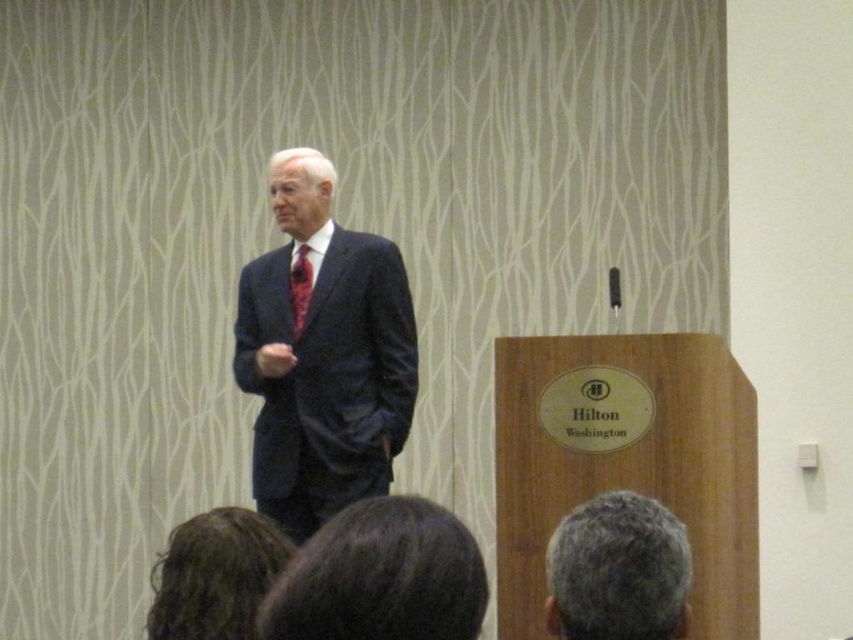
Question: Based on their relative distances, which object is nearer to the dark brown hair at lower left?

Choices:
 (A) dark brown hair at lower center
 (B) shiny red tie at center

Answer: (A)

Question: Is dark blue suit at center smaller than gray hair at lower center?

Choices:
 (A) no
 (B) yes

Answer: (A)

Question: In this image, where is dark blue suit at center located relative to shiny red tie at center?

Choices:
 (A) above
 (B) below

Answer: (B)

Question: Which is farther from the shiny red tie at center?

Choices:
 (A) dark blue suit at center
 (B) gray hair at lower center
 (C) dark brown hair at lower left
 (D) dark brown hair at lower center

Answer: (D)

Question: Is dark brown hair at lower center below gray hair at lower center?

Choices:
 (A) no
 (B) yes

Answer: (A)

Question: Based on their relative distances, which object is farther from the gray hair at lower center?

Choices:
 (A) dark blue suit at center
 (B) shiny red tie at center

Answer: (B)